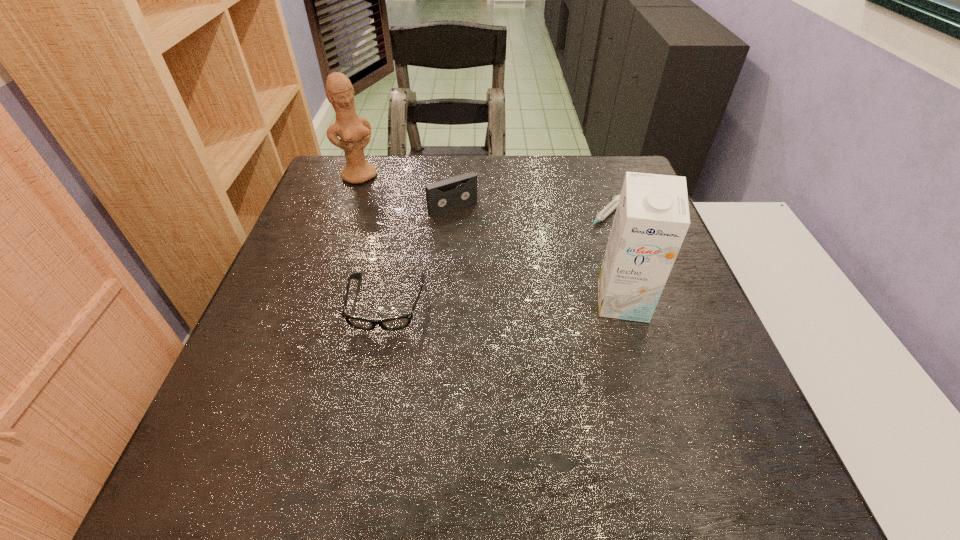
At what (x,y) coordinates should I click in order to perform the action: click on the second shortest object. Please return your answer as a coordinate pair (x, y). Looking at the image, I should click on (396, 323).

The width and height of the screenshot is (960, 540). Find the location of `carton`. carton is located at coordinates (652, 218).

In order to click on the shortest object in this screenshot , I will do `click(613, 204)`.

Image resolution: width=960 pixels, height=540 pixels. Identify the location of the third shortest object. (442, 196).

Locate an element on the screen. The width and height of the screenshot is (960, 540). figurine is located at coordinates (355, 132).

Locate an element on the screen. This screenshot has height=540, width=960. the farthest object is located at coordinates (355, 132).

The width and height of the screenshot is (960, 540). Identify the location of free spot located on the front-facing side of the spectacles. (369, 390).

Where is `free spot located on the back of the carton`? The image size is (960, 540). free spot located on the back of the carton is located at coordinates (604, 240).

Locate an element on the screen. The image size is (960, 540). vacant space situated 0.050m at the needle end of the syringe is located at coordinates (584, 239).

The width and height of the screenshot is (960, 540). Identify the location of blank area located 0.190m at the needle end of the syringe. (552, 269).